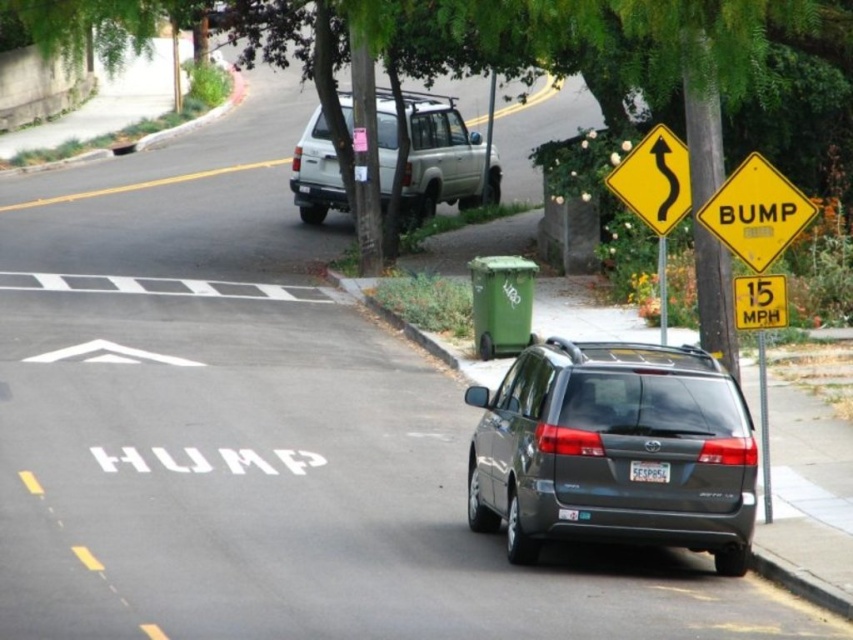
Question: Can you confirm if matte gray minivan at lower right is positioned above silver metallic suv at upper center?

Choices:
 (A) yes
 (B) no

Answer: (B)

Question: Does silver metallic suv at upper center lie in front of yellow reflective plastic at upper right?

Choices:
 (A) no
 (B) yes

Answer: (A)

Question: Which is farther from the white plastic license plate at center?

Choices:
 (A) matte gray minivan at lower right
 (B) yellow reflective plastic at upper right

Answer: (B)

Question: Among these objects, which one is farthest from the camera?

Choices:
 (A) white plastic license plate at center
 (B) yellow plastic sign at upper right
 (C) matte gray minivan at lower right

Answer: (B)

Question: Among these points, which one is farthest from the camera?

Choices:
 (A) (680, 369)
 (B) (685, 164)
 (C) (741, 312)

Answer: (B)

Question: Does silver metallic suv at upper center have a lesser width compared to yellow reflective plastic at upper right?

Choices:
 (A) yes
 (B) no

Answer: (B)